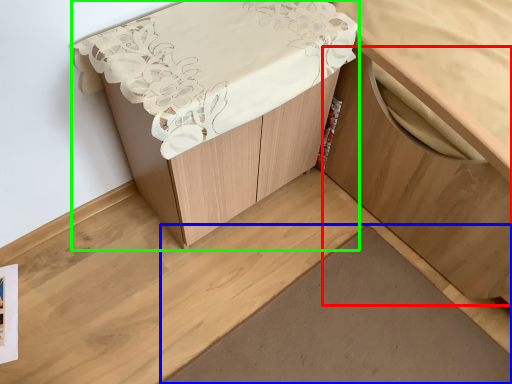
Question: Based on their relative distances, which object is farther from cabinetry (highlighted by a red box)? Choose from plank (highlighted by a blue box) and furniture (highlighted by a green box).

Choices:
 (A) plank
 (B) furniture

Answer: (B)